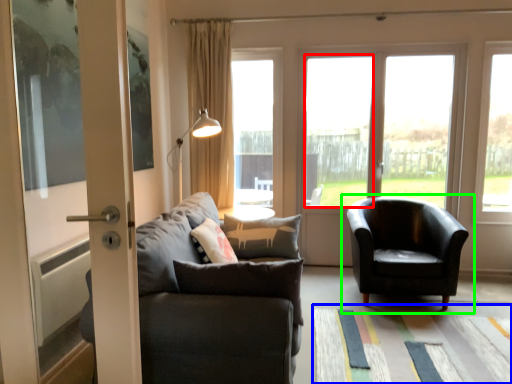
Question: Which object is positioned farthest from window (highlighted by a red box)? Select from mat (highlighted by a blue box) and chair (highlighted by a green box).

Choices:
 (A) mat
 (B) chair

Answer: (A)